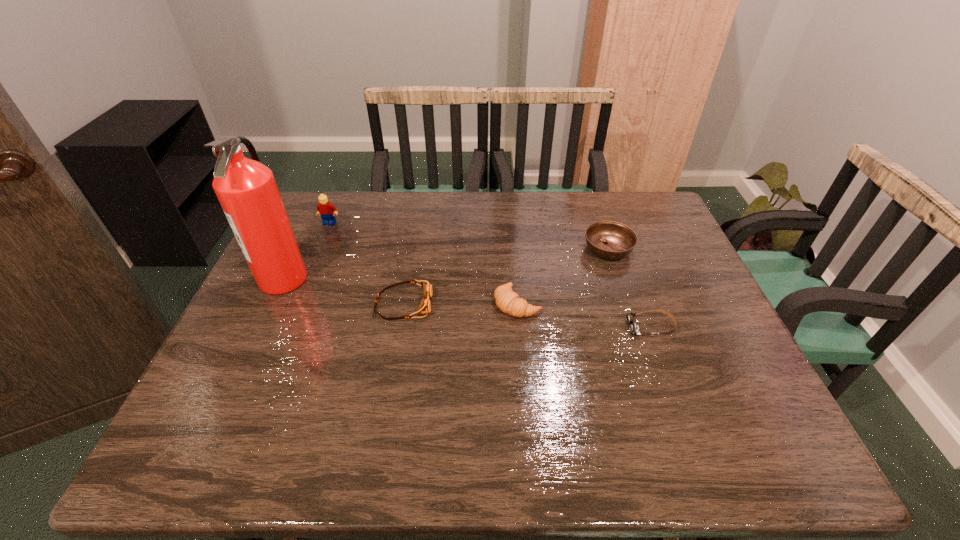
You are a GUI agent. You are given a task and a screenshot of the screen. Output one action in this format:
    pyautogui.click(x=<x>, y=<y>)
    Task: Click on the free space between the soup bowl and the taller goggles
    The image size is (960, 540).
    Given the screenshot: What is the action you would take?
    pyautogui.click(x=506, y=277)

Image resolution: width=960 pixels, height=540 pixels. Identify the location of free point between the tallest object and the shorter goggles. (468, 302).

Locate an element on the screen. Image resolution: width=960 pixels, height=540 pixels. empty space that is in between the Lego and the fourth object from left to right is located at coordinates (423, 263).

This screenshot has width=960, height=540. I want to click on free spot between the fourth object from left to right and the fire extinguisher, so click(400, 291).

Where is `free point between the crescent roll and the second tallest object`? free point between the crescent roll and the second tallest object is located at coordinates (423, 263).

You are a GUI agent. You are given a task and a screenshot of the screen. Output one action in this format:
    pyautogui.click(x=<x>, y=<y>)
    Task: Click on the free space between the left goggles and the fourth object from left to right
    
    Given the screenshot: What is the action you would take?
    pyautogui.click(x=461, y=304)

This screenshot has width=960, height=540. Identify the location of vacant space that's between the Lego and the soup bowl. (468, 236).

This screenshot has width=960, height=540. What are the coordinates of `free spot between the soup bowl and the taller goggles` in the screenshot? It's located at (506, 277).

Where is `object that is the second nearest to the right goggles`? This screenshot has width=960, height=540. object that is the second nearest to the right goggles is located at coordinates (509, 302).

Locate an element on the screen. object that is the third nearest to the fifth shortest object is located at coordinates (509, 302).